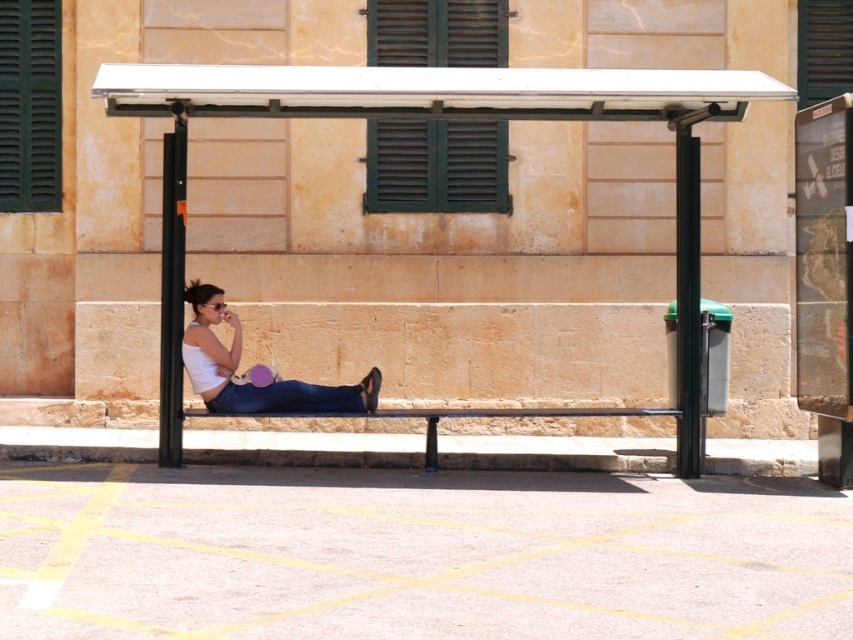
Question: Is green matte shutters at upper center to the left of metallic black bench at center from the viewer's perspective?

Choices:
 (A) no
 (B) yes

Answer: (B)

Question: Which of the following is the closest to the observer?

Choices:
 (A) white matte tank top at center
 (B) white plastic bench at center

Answer: (B)

Question: Does white matte tank top at center come behind metallic black bench at center?

Choices:
 (A) yes
 (B) no

Answer: (A)

Question: Which object is closer to the camera taking this photo?

Choices:
 (A) white plastic bench at center
 (B) green matte shutter at upper left
 (C) green matte shutters at upper center

Answer: (A)

Question: Can you confirm if green matte shutter at upper left is positioned above metallic black bench at center?

Choices:
 (A) no
 (B) yes

Answer: (B)

Question: Which object appears farthest from the camera in this image?

Choices:
 (A) metallic black bench at center
 (B) green matte shutters at upper center

Answer: (B)